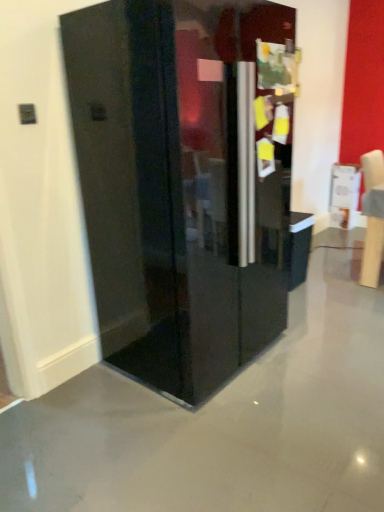
Describe the element at coordinates (372, 252) in the screenshot. I see `wooden mannequin arm at right` at that location.

What are the coordinates of `wooden mannequin arm at right` in the screenshot? It's located at (372, 252).

Locate an element on the screen. The height and width of the screenshot is (512, 384). wooden mannequin arm at right is located at coordinates (372, 252).